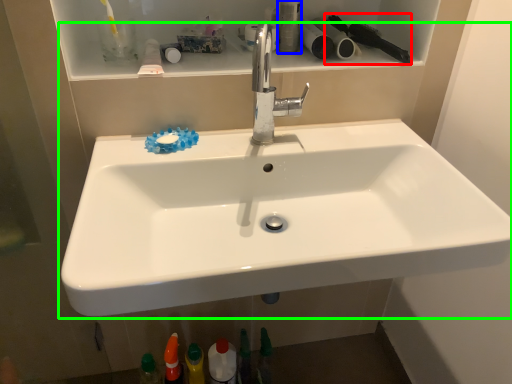
Question: Estimate the real-world distances between objects in this image. Which object is closer to brush (highlighted by a red box), toiletry (highlighted by a blue box) or sink (highlighted by a green box)?

Choices:
 (A) toiletry
 (B) sink

Answer: (A)